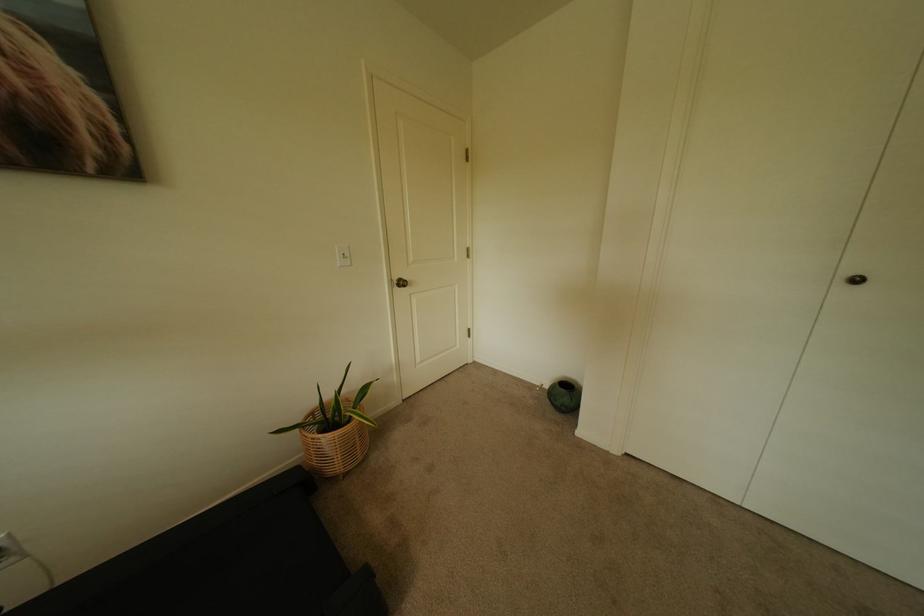
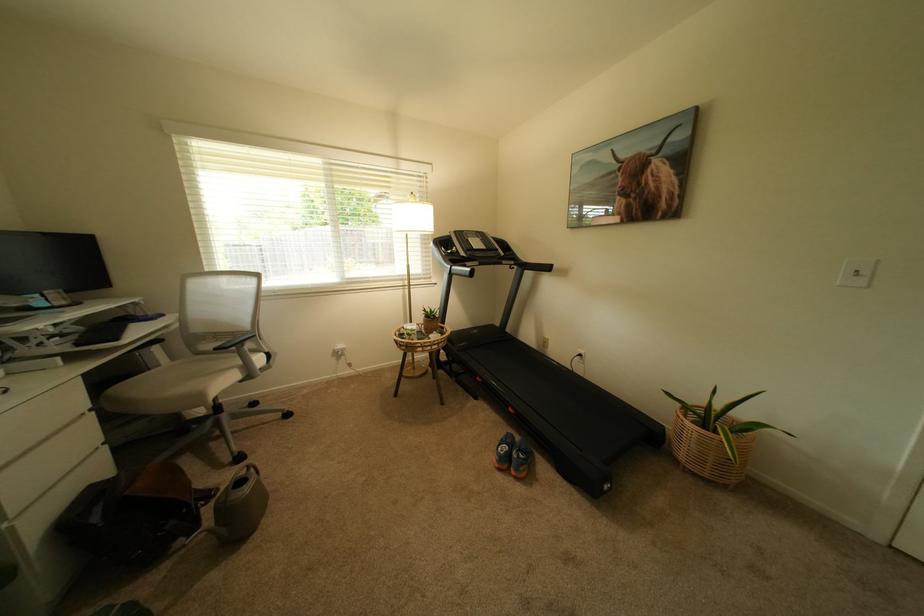
Where in the second image is the point corresponding to (347,458) from the first image?

(695, 448)